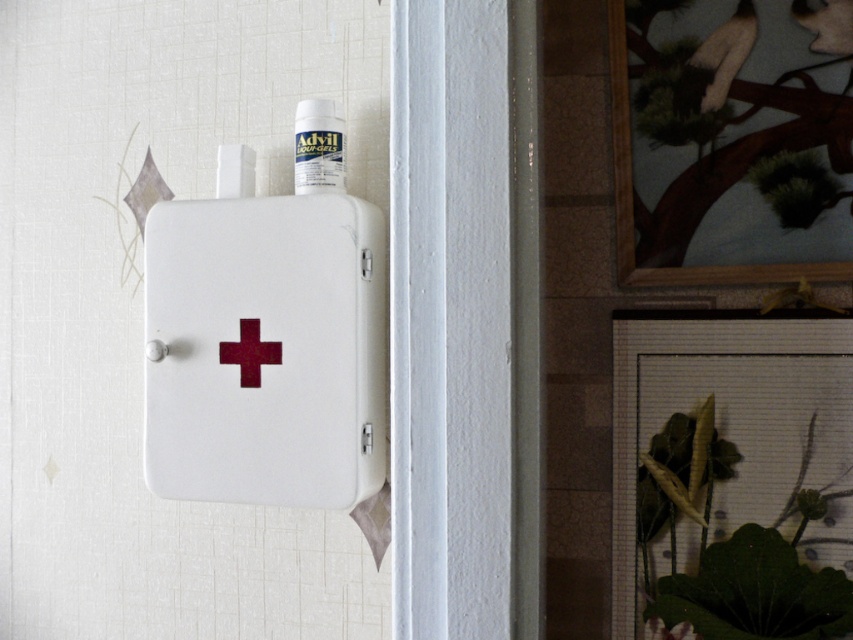
You are standing in front of the first aid box and want to reach both points. Which point, point (320, 168) or point (231, 362), is closer to you?

Point (320, 168) is closer to you because it is further to the viewer than point (231, 362).

You are a nurse preparing to place a new medication bottle on the wall next to the first aid box. The new bottle is wider than the white plastic bottle at upper center but narrower than the maroon matte cross at center. Where should you place the new bottle to ensure it fits properly?

The new bottle should be placed where the maroon matte cross at center is located since it has a greater width than the white plastic bottle at upper center, accommodating the new bottle.

You are a painter who needs to hang a new painting that is 1.2 meters wide. You see the white matte first aid box at center and the framed artwork to the right. Is there enough space between them to hang your painting?

The distance between the white matte first aid box at center and the framed artwork to the right is 1.16 meters. Since the painting is 1.2 meters wide, there isn not enough space to hang it between them.